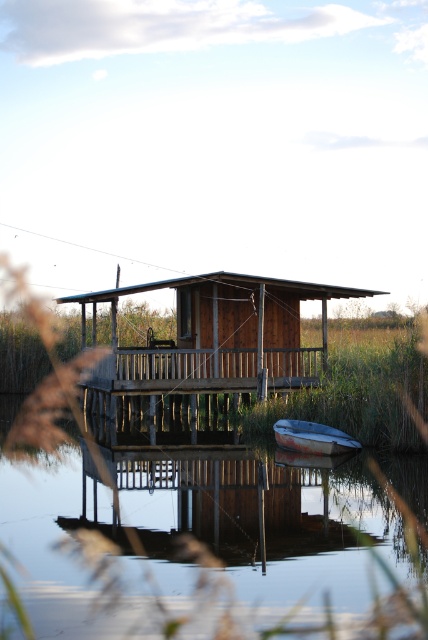
You are standing on the dock and want to check the water level relative to the boat. According to the scene, where is the transparent water at center in relation to the rusty metal boat at lower center?

The transparent water at center is located below the rusty metal boat at lower center, meaning the boat is floating on top of the water.

You are standing at the lakeside and want to place a small decorative rock at each of the two points indicated in the image. The first point is labeled as point (104,561) and the second as point (284,436). If you want to place the rocks so that one is in front of the other from your current viewpoint, which point should you place the rock closer to you?

Point (104,561) is in front of point (284,436), so you should place the rock closer to you at point (104,561) to have it in front of the other rock.

You are standing on the lakeside dock and want to take a photo of both the transparent water at center and the rusty metal boat at lower center. Which object will appear larger in your photo?

The transparent water at center will appear larger in the photo because it is closer to the viewer than the rusty metal boat at lower center.